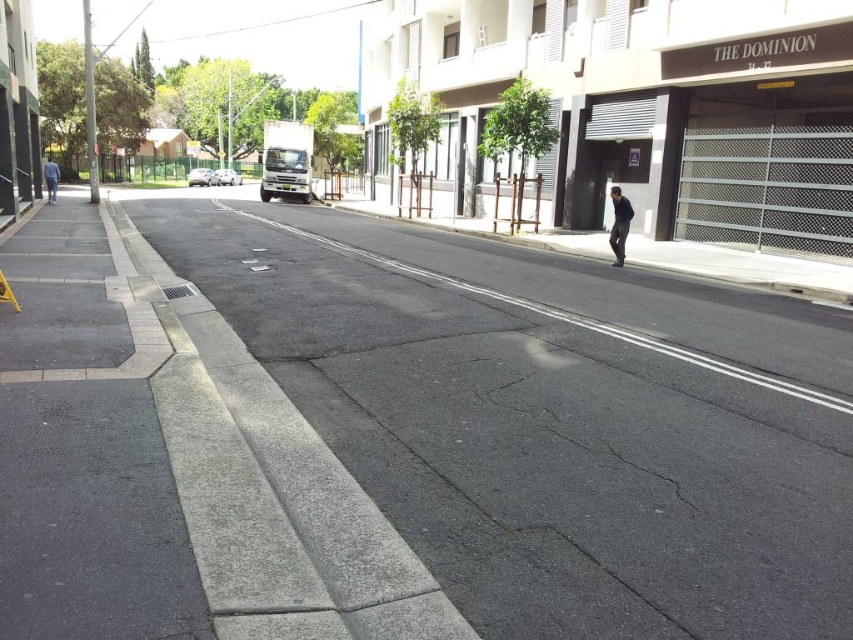
Question: Is gray concrete pavement at center in front of silver metallic sedan at center?

Choices:
 (A) yes
 (B) no

Answer: (A)

Question: Among these points, which one is nearest to the camera?

Choices:
 (A) (416, 244)
 (B) (624, 211)

Answer: (B)

Question: Can you confirm if gray concrete sidewalk at lower left is thinner than gray asphalt crack at center?

Choices:
 (A) yes
 (B) no

Answer: (B)

Question: Among these points, which one is farthest from the camera?

Choices:
 (A) (543, 468)
 (B) (618, 253)
 (C) (51, 193)
 (D) (218, 173)

Answer: (D)

Question: Which of these objects is positioned farthest from the silver metallic sedan at center?

Choices:
 (A) gray concrete pavement at center
 (B) blue jeans at left
 (C) gray asphalt crack at center

Answer: (C)

Question: Is silver metallic car at center-left behind silver metallic sedan at center?

Choices:
 (A) yes
 (B) no

Answer: (B)